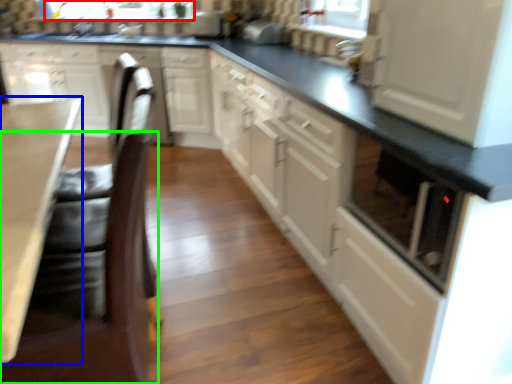
Question: Based on their relative distances, which object is nearer to bay window (highlighted by a red box)? Choose from countertop (highlighted by a blue box) and swivel chair (highlighted by a green box).

Choices:
 (A) countertop
 (B) swivel chair

Answer: (A)